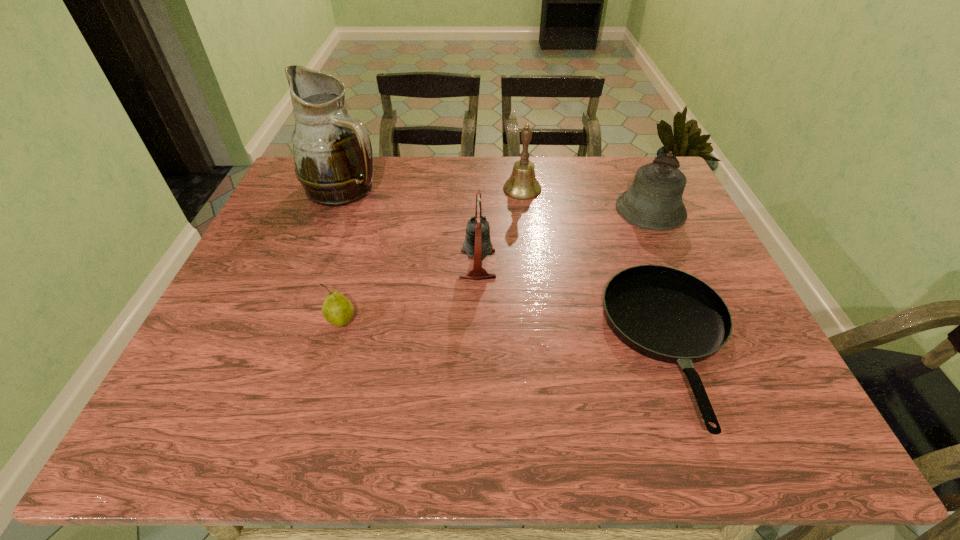
Locate an element on the screen. The height and width of the screenshot is (540, 960). the tallest object is located at coordinates (332, 151).

In order to click on the second bell from right to left in this screenshot , I will do `click(522, 185)`.

Identify the location of the nearest bell. Image resolution: width=960 pixels, height=540 pixels. (477, 244).

Where is `the leftmost bell`? Image resolution: width=960 pixels, height=540 pixels. the leftmost bell is located at coordinates (477, 244).

The image size is (960, 540). Identify the location of the rightmost bell. (654, 201).

At what (x,y) coordinates should I click in order to perform the action: click on the fifth tallest object. Please return your answer as a coordinate pair (x, y). The image size is (960, 540). Looking at the image, I should click on (337, 309).

The height and width of the screenshot is (540, 960). In order to click on the shortest object in this screenshot , I will do click(666, 314).

Identify the location of free region located from the spout of the pitcher. This screenshot has height=540, width=960. (459, 188).

The image size is (960, 540). I want to click on free region located on the right of the second bell from left to right, so click(650, 189).

Locate an element on the screen. vacant point located on the front of the nearest bell is located at coordinates (478, 318).